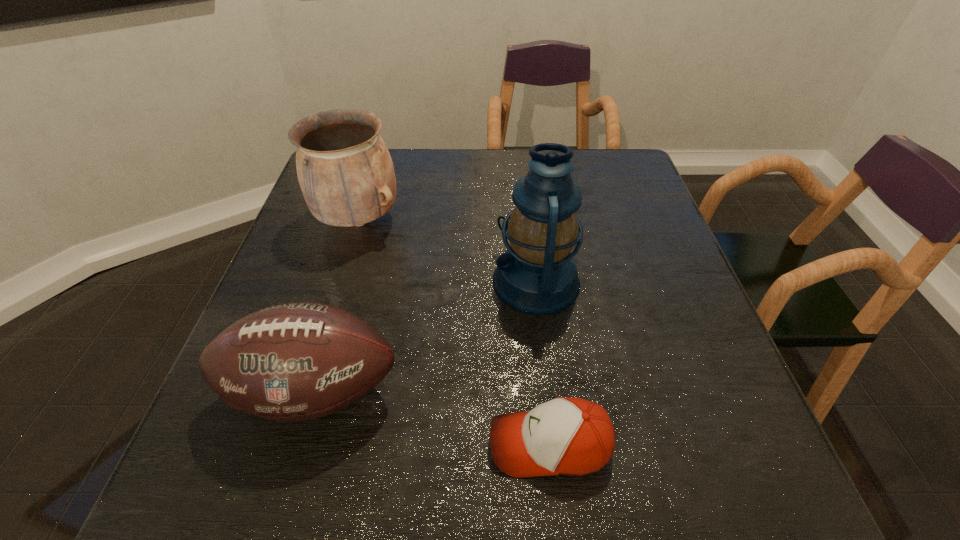
Identify the location of vacant space that's between the tallest object and the third tallest object. The height and width of the screenshot is (540, 960). (425, 336).

In order to click on vacant area that lies between the lantern and the second shortest object in this screenshot , I will do `click(425, 336)`.

Identify the location of unoccupied area between the lantern and the baseball cap. The height and width of the screenshot is (540, 960). (542, 363).

Find the location of a particular element. free space between the football (American) and the tallest object is located at coordinates (425, 336).

Image resolution: width=960 pixels, height=540 pixels. What are the coordinates of `empty location between the football (American) and the baseball cap` in the screenshot? It's located at (432, 418).

Where is `empty space between the third shortest object and the tallest object`? empty space between the third shortest object and the tallest object is located at coordinates (447, 251).

Identify the location of empty location between the lantern and the shortest object. This screenshot has height=540, width=960. pyautogui.click(x=542, y=363).

At what (x,y) coordinates should I click in order to perform the action: click on free spot between the shortest object and the tallest object. Please return your answer as a coordinate pair (x, y). The height and width of the screenshot is (540, 960). Looking at the image, I should click on click(x=542, y=363).

Find the location of a particular element. unoccupied area between the second tallest object and the third tallest object is located at coordinates 337,306.

Identify the location of vacant space that is in between the tallest object and the urn. (447, 251).